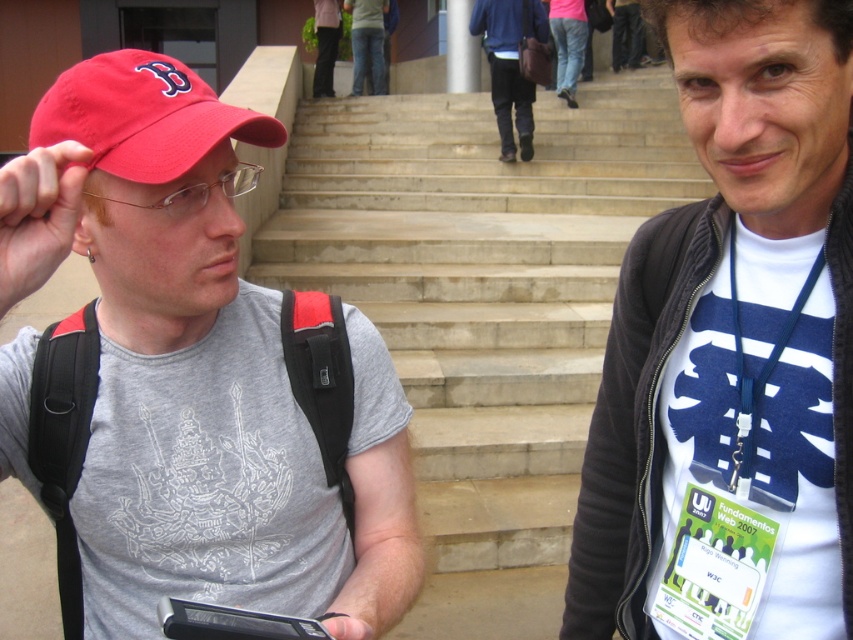
Question: Which point is farther to the camera?

Choices:
 (A) (358, 45)
 (B) (306, 621)
 (C) (790, 600)
 (D) (334, 589)

Answer: (A)

Question: Can you confirm if white matte t-shirt at center is thinner than matte red cap at upper left?

Choices:
 (A) no
 (B) yes

Answer: (B)

Question: Which point is farther to the camera?

Choices:
 (A) black plastic smartphone at lower left
 (B) matte red cap at upper left
 (C) matte red baseball cap at left
 (D) dark blue jeans at center

Answer: (D)

Question: In this image, where is matte red cap at upper left located relative to dark blue jeans at center?

Choices:
 (A) above
 (B) below

Answer: (B)

Question: Does white matte t-shirt at center lie in front of matte red cap at upper left?

Choices:
 (A) no
 (B) yes

Answer: (A)

Question: Which point appears closest to the camera in this image?

Choices:
 (A) (721, 168)
 (B) (596, 323)
 (C) (383, 554)
 (D) (474, 32)

Answer: (A)